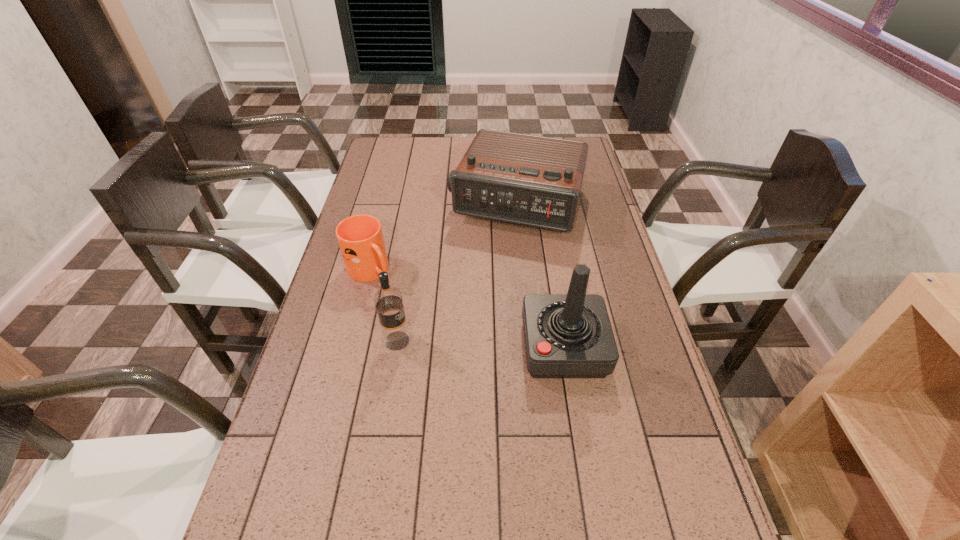
Find the location of a particular element. The width and height of the screenshot is (960, 540). vodka is located at coordinates (388, 301).

Find the location of a particular element. joystick is located at coordinates (569, 335).

Where is `the leftmost object`? Image resolution: width=960 pixels, height=540 pixels. the leftmost object is located at coordinates (360, 237).

The height and width of the screenshot is (540, 960). Identify the location of the shortest object. (360, 237).

The width and height of the screenshot is (960, 540). In order to click on radio receiver in this screenshot , I will do `click(529, 180)`.

The image size is (960, 540). I want to click on vacant space located on the label of the third object from right to left, so (x=531, y=341).

You are a GUI agent. You are given a task and a screenshot of the screen. Output one action in this format:
    pyautogui.click(x=<x>, y=<y>)
    Task: Click on the vacant space positioned on the front-facing side of the joystick
    
    Given the screenshot: What is the action you would take?
    pyautogui.click(x=504, y=347)

You are a GUI agent. You are given a task and a screenshot of the screen. Output one action in this format:
    pyautogui.click(x=<x>, y=<y>)
    Task: Click on the free space located 0.150m on the front-facing side of the joystick
    The image size is (960, 540).
    Given the screenshot: What is the action you would take?
    pyautogui.click(x=467, y=347)

Find the location of a particular element. The height and width of the screenshot is (540, 960). vacant position located on the front-facing side of the joystick is located at coordinates (493, 347).

Find the location of a particular element. The width and height of the screenshot is (960, 540). vacant space located on the handle side of the leftmost object is located at coordinates (424, 315).